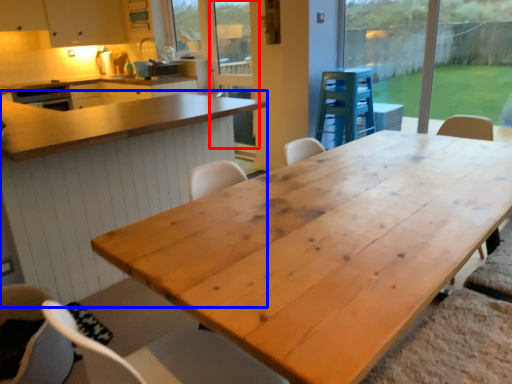
Question: Which object appears farthest to the camera in this image, screen door (highlighted by a red box) or table (highlighted by a blue box)?

Choices:
 (A) screen door
 (B) table

Answer: (A)